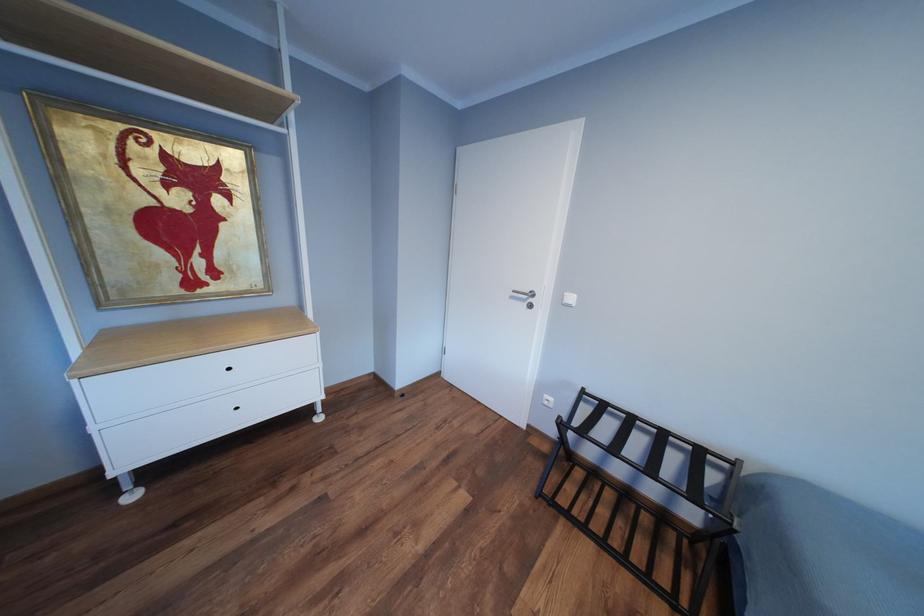
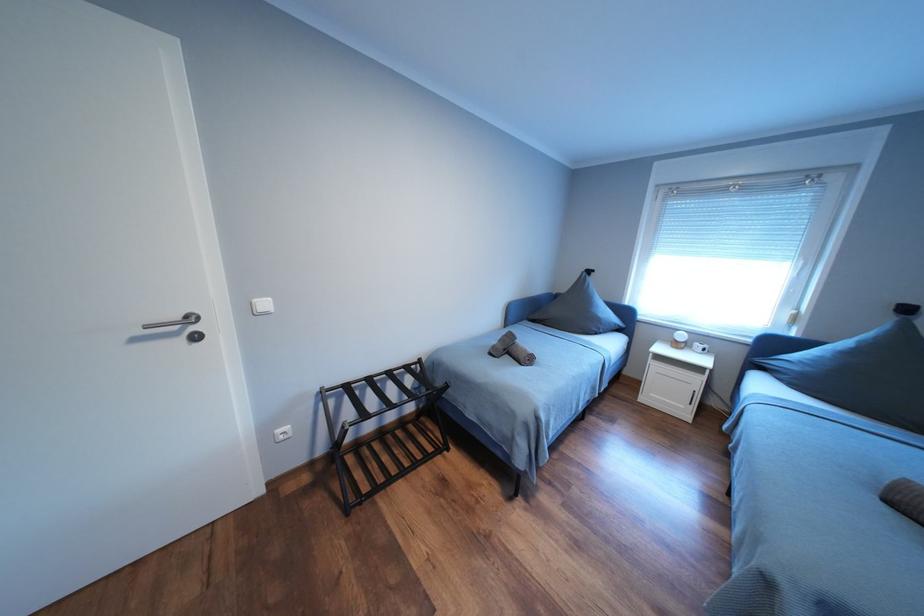
First-person continuous shooting, in which direction is the camera rotating?

The camera's rotation is toward right-down.